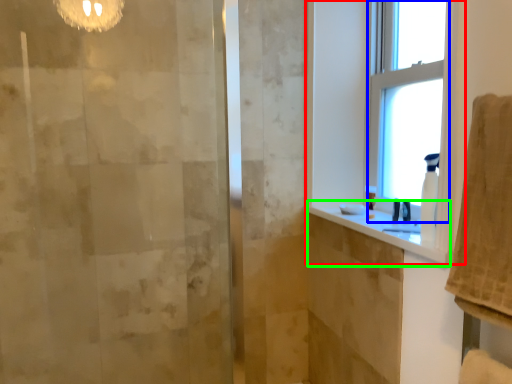
Question: Which object is positioned farthest from window (highlighted by a red box)? Select from window (highlighted by a blue box) and counter top (highlighted by a green box).

Choices:
 (A) window
 (B) counter top

Answer: (B)